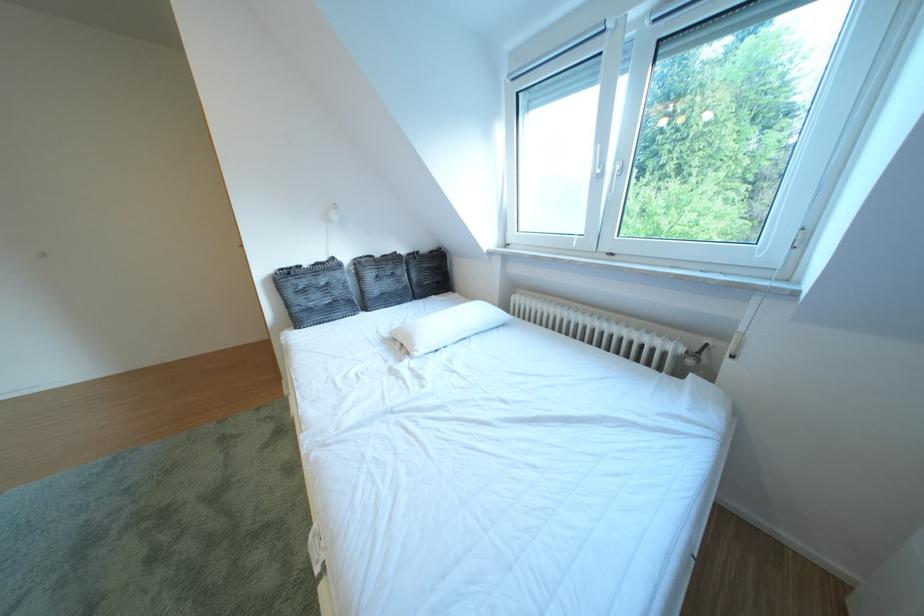
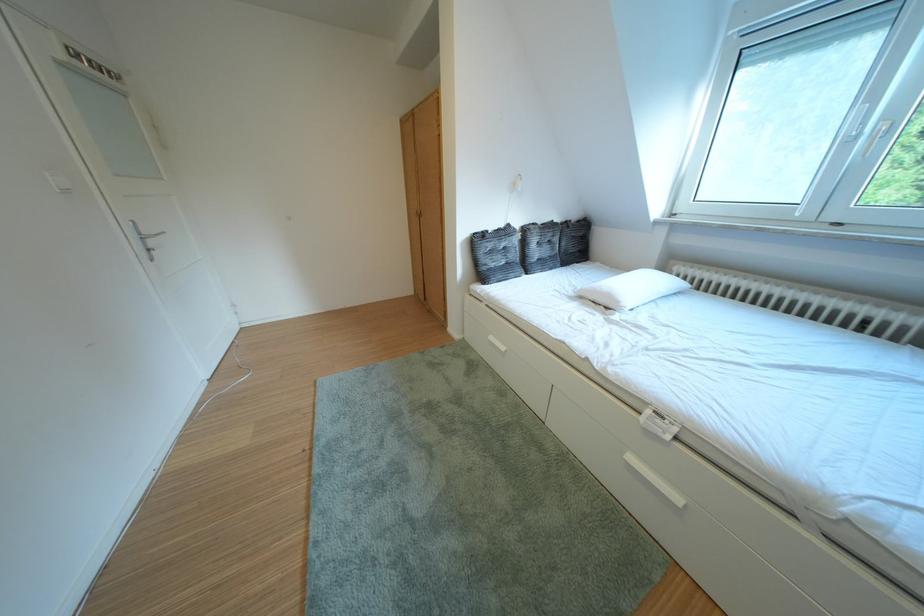
Where in the second image is the point corresponding to point 346,264 from the first image?

(523, 230)